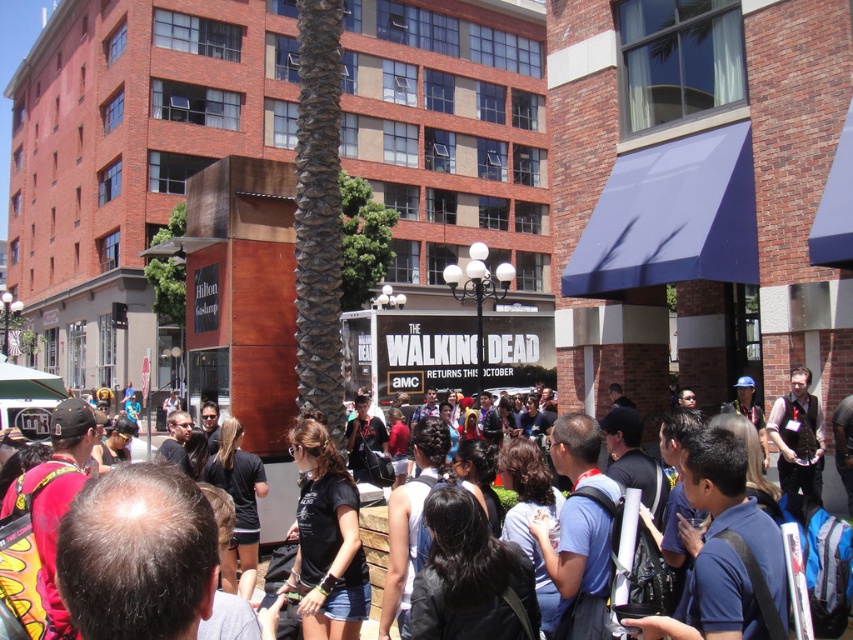
Question: In this image, where is black matte t-shirt at center located relative to black t-shirt at center?

Choices:
 (A) right
 (B) left

Answer: (A)

Question: Is black matte t-shirt at center bigger than black t-shirt at center?

Choices:
 (A) no
 (B) yes

Answer: (A)

Question: Can you confirm if black matte t-shirt at center is wider than black t-shirt at center?

Choices:
 (A) no
 (B) yes

Answer: (A)